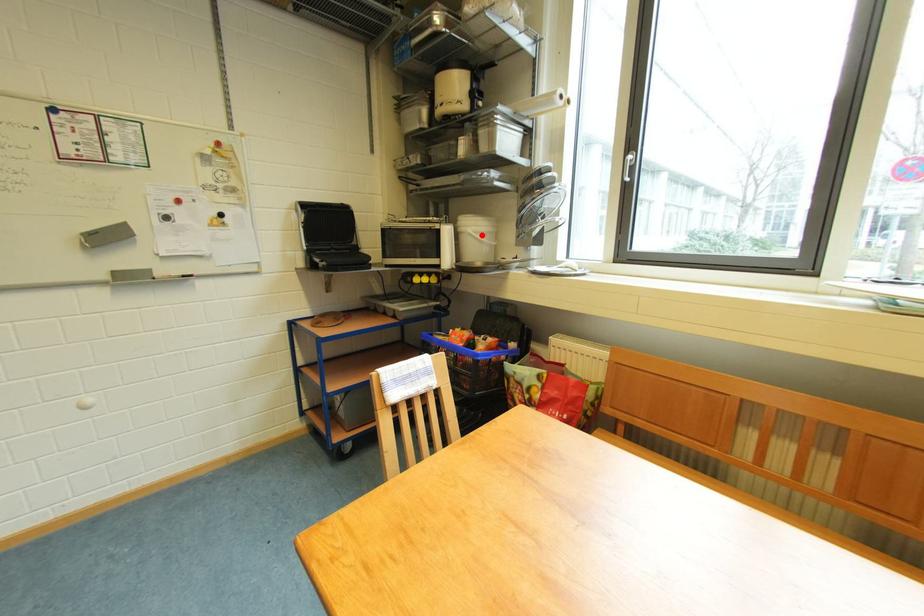
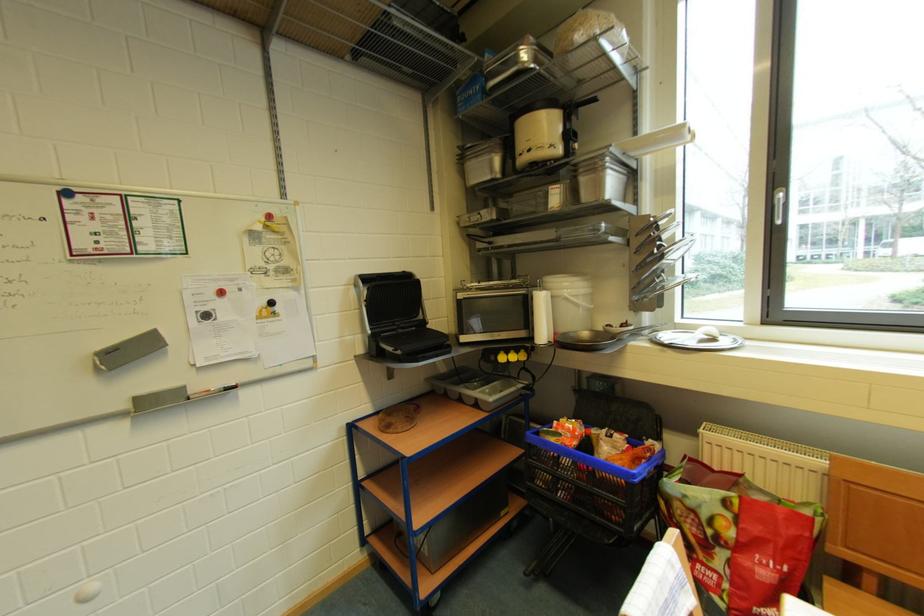
In the second image, find the point that corresponds to the highlighted location in the first image.

(578, 299)